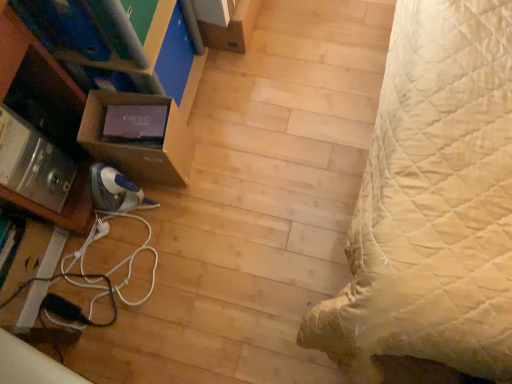
Question: Can we say brown cardboard box at left, placed as the 1th shelf when sorted from right to left, lies outside matte black monitor at left?

Choices:
 (A) no
 (B) yes

Answer: (B)

Question: Considering the relative sizes of brown cardboard box at left, placed as the 1th shelf when sorted from right to left, and matte black monitor at left in the image provided, is brown cardboard box at left, placed as the 1th shelf when sorted from right to left, smaller than matte black monitor at left?

Choices:
 (A) yes
 (B) no

Answer: (A)

Question: Does brown cardboard box at left, the 2th shelf positioned from the left, turn towards matte black monitor at left?

Choices:
 (A) no
 (B) yes

Answer: (A)

Question: Considering the relative positions of brown cardboard box at left, placed as the 1th shelf when sorted from right to left, and matte black monitor at left in the image provided, is brown cardboard box at left, placed as the 1th shelf when sorted from right to left, to the left of matte black monitor at left from the viewer's perspective?

Choices:
 (A) no
 (B) yes

Answer: (A)

Question: Is the position of brown cardboard box at left, the 2th shelf positioned from the left, less distant than that of matte black monitor at left?

Choices:
 (A) no
 (B) yes

Answer: (A)

Question: From a real-world perspective, does brown cardboard box at left, the 2th shelf positioned from the left, stand above matte black monitor at left?

Choices:
 (A) yes
 (B) no

Answer: (B)

Question: Does white cord at lower left have a lesser width compared to metallic silver shelf at lower left, arranged as the first shelf when viewed from the left?

Choices:
 (A) no
 (B) yes

Answer: (B)

Question: Is white cord at lower left turned away from metallic silver shelf at lower left, arranged as the first shelf when viewed from the left?

Choices:
 (A) yes
 (B) no

Answer: (B)

Question: Is white cord at lower left bigger than metallic silver shelf at lower left, arranged as the first shelf when viewed from the left?

Choices:
 (A) yes
 (B) no

Answer: (B)

Question: Is white cord at lower left placed right next to metallic silver shelf at lower left, arranged as the first shelf when viewed from the left?

Choices:
 (A) no
 (B) yes

Answer: (A)

Question: Is white cord at lower left wider than metallic silver shelf at lower left, arranged as the first shelf when viewed from the left?

Choices:
 (A) yes
 (B) no

Answer: (B)

Question: Would you consider white cord at lower left to be distant from metallic silver shelf at lower left, arranged as the first shelf when viewed from the left?

Choices:
 (A) yes
 (B) no

Answer: (B)

Question: From the image's perspective, is white cord at lower left on brown cardboard box at left, the 2th shelf positioned from the left?

Choices:
 (A) no
 (B) yes

Answer: (A)